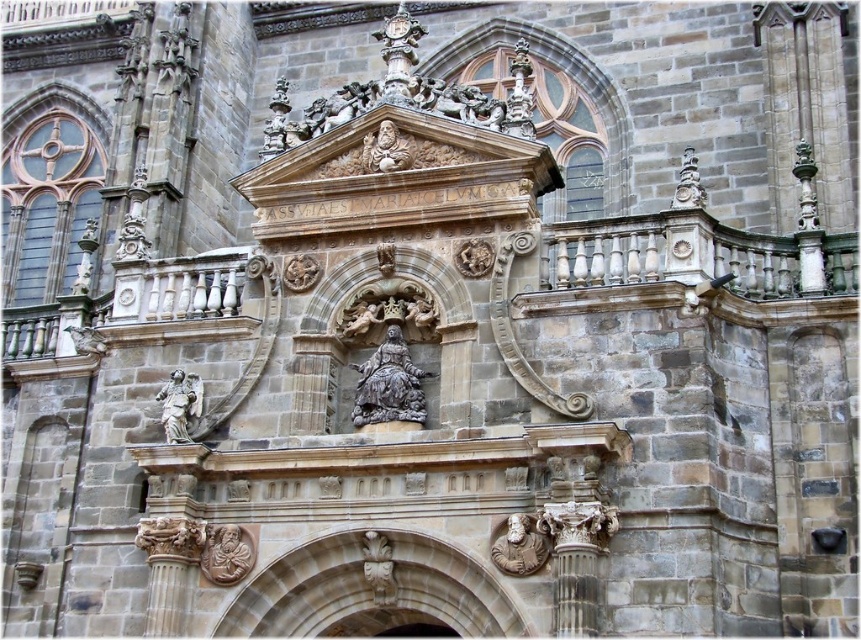
Question: Which point appears closest to the camera in this image?

Choices:
 (A) (228, 536)
 (B) (165, 413)
 (C) (386, 330)

Answer: (A)

Question: Is polished bronze angel at lower left further to camera compared to carved stone angel at lower center?

Choices:
 (A) no
 (B) yes

Answer: (B)

Question: Is gray stone statue at center further to the viewer compared to polished bronze angel at lower left?

Choices:
 (A) no
 (B) yes

Answer: (A)

Question: Which object is positioned closest to the polished bronze angel at lower left?

Choices:
 (A) carved stone angel at lower center
 (B) brown stone sculpture at lower left
 (C) brown stone bust at lower right
 (D) gray stone statue at center

Answer: (B)

Question: Which object is closer to the camera taking this photo?

Choices:
 (A) gray stone statue at center
 (B) polished bronze angel at lower left
 (C) brown stone sculpture at lower left
 (D) carved stone angel at lower center

Answer: (D)

Question: Is brown stone bust at lower right smaller than carved stone angel at lower center?

Choices:
 (A) yes
 (B) no

Answer: (A)